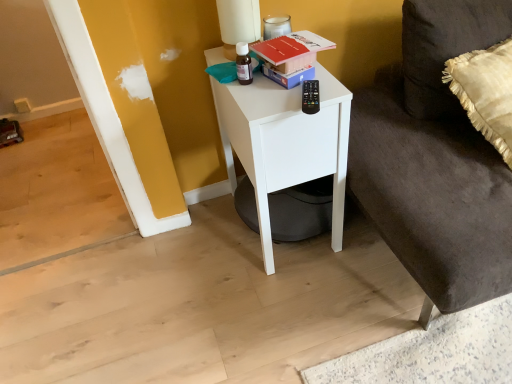
At what (x,y) coordinates should I click in order to perform the action: click on vacant space to the left of white matte nightstand at center. Please return your answer as a coordinate pair (x, y). The width and height of the screenshot is (512, 384). Looking at the image, I should click on (194, 253).